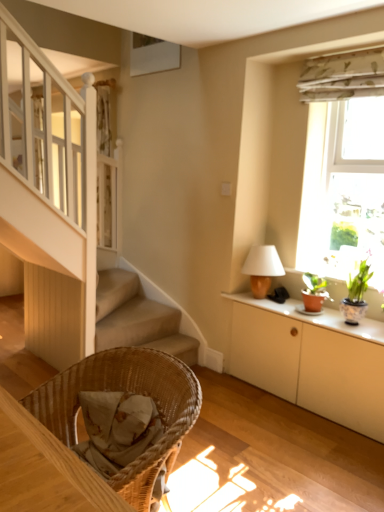
Question: In the image, is white matte cabinet at right positioned in front of or behind matte brown table lamp at upper right?

Choices:
 (A) front
 (B) behind

Answer: (A)

Question: From the image's perspective, is white matte cabinet at right located above or below matte brown table lamp at upper right?

Choices:
 (A) above
 (B) below

Answer: (B)

Question: Which is nearer to the translucent fabric curtain at upper right?

Choices:
 (A) matte brown table lamp at upper right
 (B) matte white cabinet at right
 (C) woven wood chair at lower left
 (D) white matte cabinet at right
 (E) green floral fabric at upper right

Answer: (E)

Question: Which object is positioned farthest from the green floral fabric at upper right?

Choices:
 (A) matte white cabinet at right
 (B) woven wood chair at lower left
 (C) matte brown table lamp at upper right
 (D) translucent fabric curtain at upper right
 (E) white matte cabinet at right

Answer: (B)